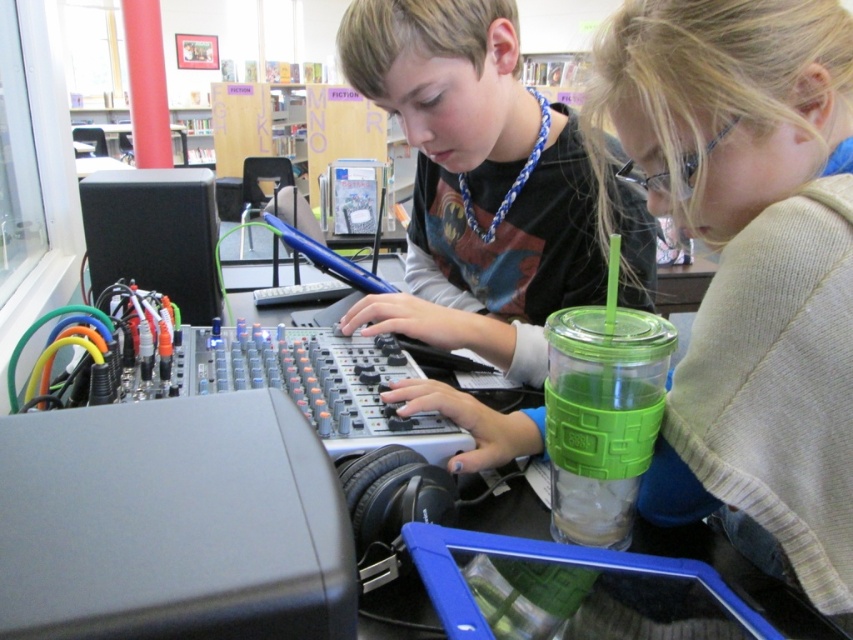
Does green plastic cup at center have a greater width compared to matte black shirt at center?

Incorrect, green plastic cup at center's width does not surpass matte black shirt at center's.

Does point (770, 97) lie behind point (445, 266)?

No, (770, 97) is closer to viewer.

Identify the location of green plastic cup at center. This screenshot has height=640, width=853. (750, 262).